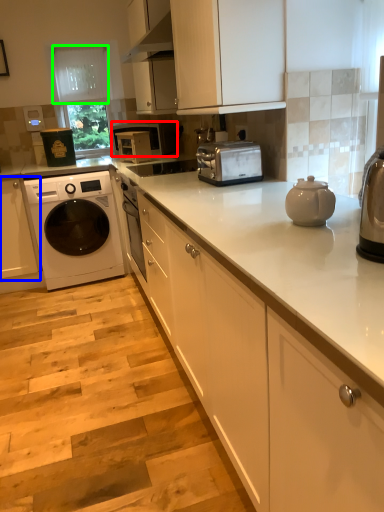
Question: Which object is the farthest from microwave oven (highlighted by a red box)? Choose among these: cabinetry (highlighted by a blue box) or glass door (highlighted by a green box).

Choices:
 (A) cabinetry
 (B) glass door

Answer: (A)